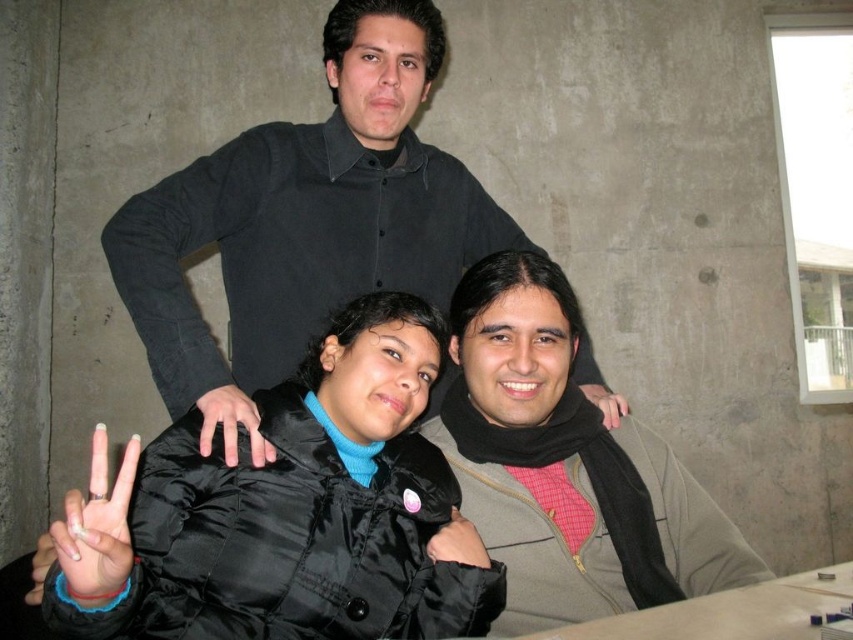
You are a photographer adjusting the lighting in the studio where the three people are posing. You need to ensure that both the matte black hand at lower left and the black matte hand at lower center are evenly lit. Given their current positions, is there enough space between them to place a small light diffuser between them?

The distance between the matte black hand at lower left and the black matte hand at lower center is 22.13 inches. A small light diffuser typically requires about 12 to 18 inches of space to be effective. Therefore, there is sufficient space to place the diffuser between them.

You are designing a poster and need to place a sticker on the black matte shirt at upper center and a smaller sticker on the matte black hand at center. Based on the image, which object should have the larger sticker?

The black matte shirt at upper center should have the larger sticker because its width is greater than the matte black hand at center.

You are a photographer trying to capture the perfect shot of the matte black scarf at center and the matte black hand at lower left. Which object should you focus on first if you want to ensure both are in frame without moving the camera?

The matte black scarf at center is taller than the matte black hand at lower left, so focusing on the scarf first will ensure the hand remains in frame as it is smaller and positioned lower.